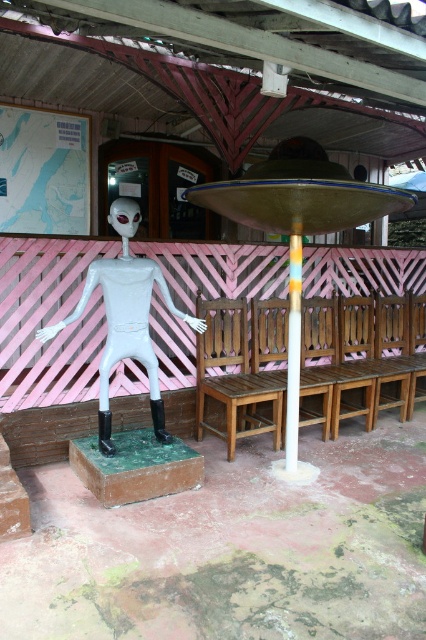
Question: Which point is farther from the camera taking this photo?

Choices:
 (A) (299, 312)
 (B) (143, 332)

Answer: (A)

Question: Is white matte alien at left positioned behind multicolored striped pole at center?

Choices:
 (A) no
 (B) yes

Answer: (A)

Question: Does white matte alien at left have a smaller size compared to multicolored striped pole at center?

Choices:
 (A) no
 (B) yes

Answer: (A)

Question: Which of the following is the closest to the observer?

Choices:
 (A) (293, 285)
 (B) (111, 218)

Answer: (B)

Question: Is white matte alien at left closer to camera compared to multicolored striped pole at center?

Choices:
 (A) no
 (B) yes

Answer: (B)